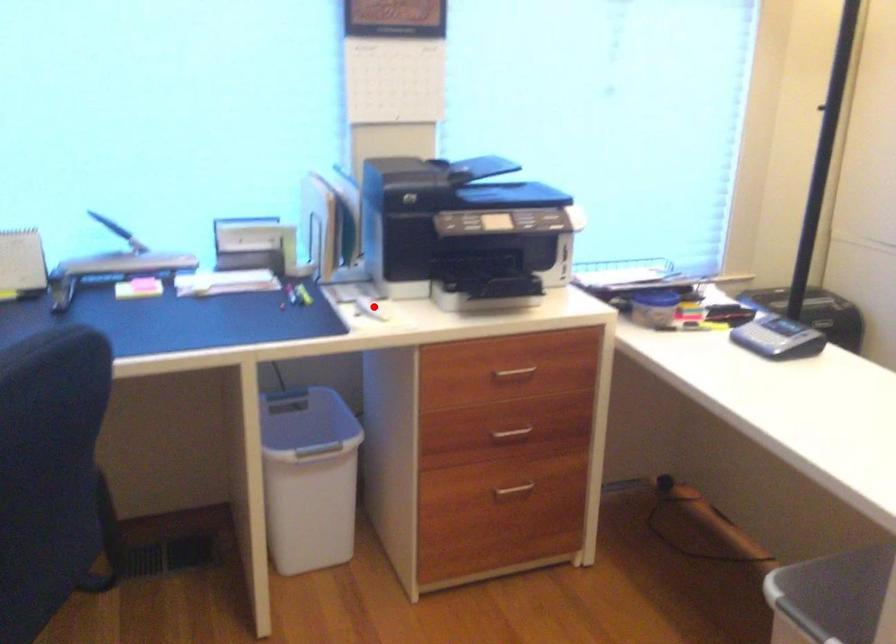
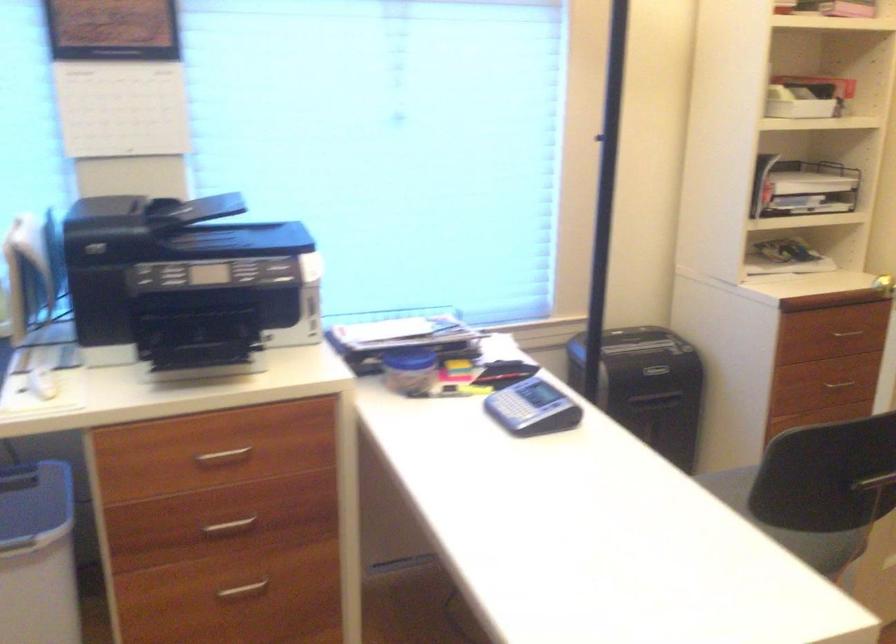
Where in the second image is the point corresponding to the highlighted location from the first image?

(41, 383)